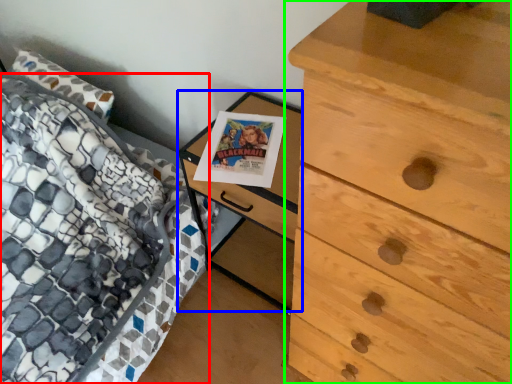
Question: Which object is positioned farthest from bed (highlighted by a red box)? Select from nightstand (highlighted by a blue box) and chest of drawers (highlighted by a green box).

Choices:
 (A) nightstand
 (B) chest of drawers

Answer: (B)